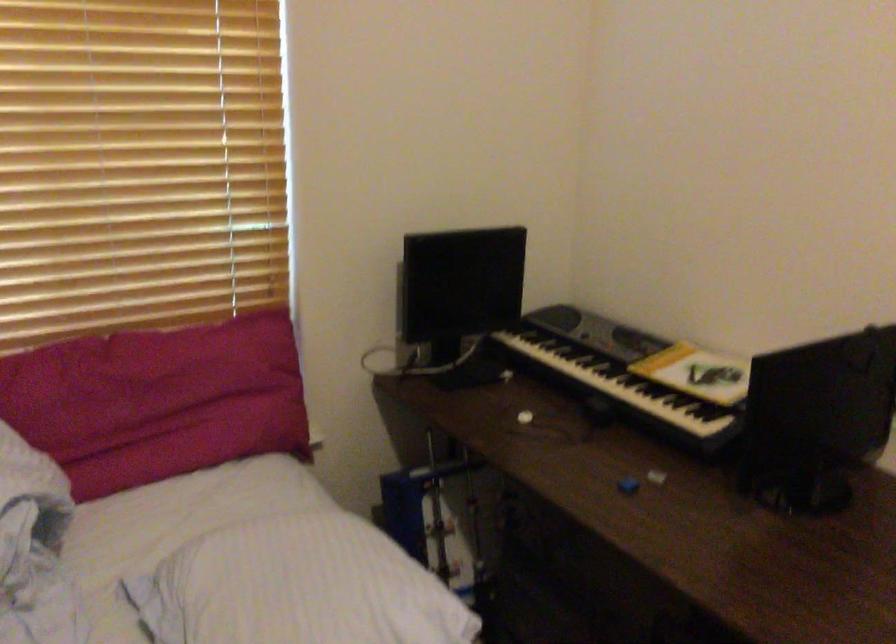
This screenshot has width=896, height=644. I want to click on keyboard keys, so click(x=618, y=383).